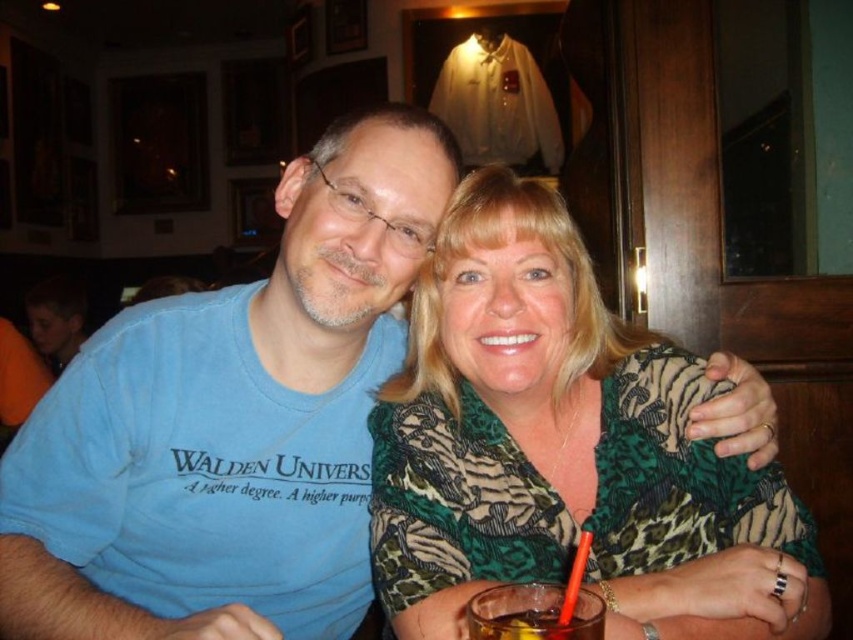
You are a server at a restaurant and need to place a 30 cm wide dessert plate between the green leopard print blouse at center and the dark amber liquid at lower center. Can the plate fit without overlapping either item?

The distance between the green leopard print blouse at center and the dark amber liquid at lower center is 37.95 centimeters. Since the dessert plate is 30 cm wide, there is enough space to place it between them without overlapping either item.

You are standing in the dining area and want to place a small plant between the two points, point [584,634] and point [575,573]. According to their positions, which point should the plant be closer to?

The plant should be placed closer to point [575,573] because point [584,634] is in front of point [575,573], meaning it is farther away from the viewer. Placing the plant closer to the point that is farther away would maintain the desired positioning between them.

You are standing in front of the scene and want to touch the point at coordinates point (x=554, y=637). Can you reach it without moving your body?

The point at coordinates point (x=554, y=637) is 21.04 inches away from you, so you can reach it without moving your body if your arm can extend that far.